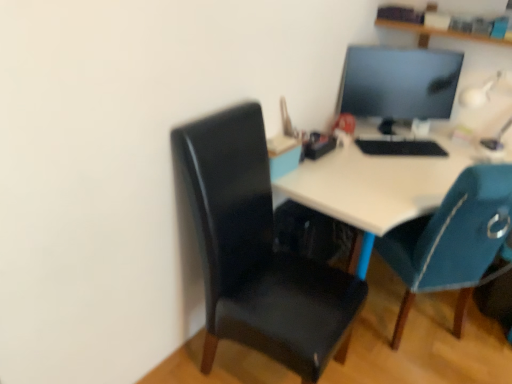
Image resolution: width=512 pixels, height=384 pixels. Find the location of `vacant space in front of matte black monitor at upper right`. vacant space in front of matte black monitor at upper right is located at coordinates pyautogui.click(x=405, y=168).